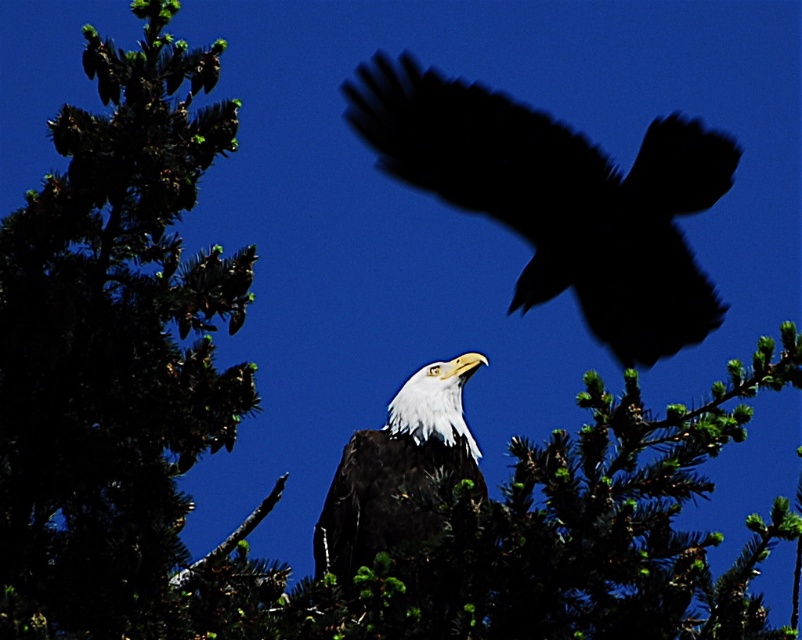
You are a birdwatcher trying to capture both the white feathered bald eagle at center and the white glossy eagle at center in a single photo. Given that your camera has a maximum focus range of 35 inches, will you be able to focus on both birds simultaneously?

The white feathered bald eagle at center and white glossy eagle at center are 38.75 inches apart. Since the distance between them exceeds the camera focus range of 35 inches, you cannot focus on both birds at the same time.

You are standing in front of the image and want to touch both points. Which point should you reach for first, point (x=711, y=300) or point (x=431, y=440)?

You should reach for point (x=711, y=300) first because it is closer to you than point (x=431, y=440).

You are an ornithologist observing the scene. You notice the green leafy tree at upper left and the white glossy eagle at center. Which object occupies a larger area in the image?

The green leafy tree at upper left is bigger than the white glossy eagle at center, so it occupies a larger area in the image.